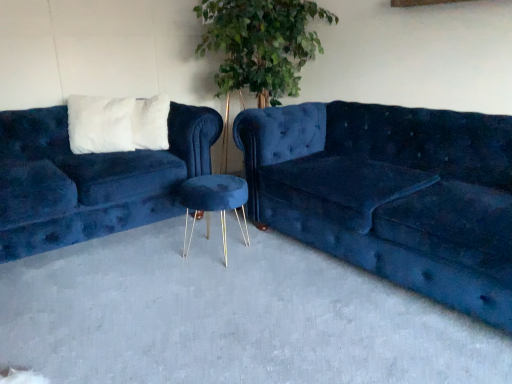
This screenshot has width=512, height=384. Identify the location of vacant point to the left of velvet blue couch at center, which ranks as the 1th studio couch in right-to-left order. (155, 292).